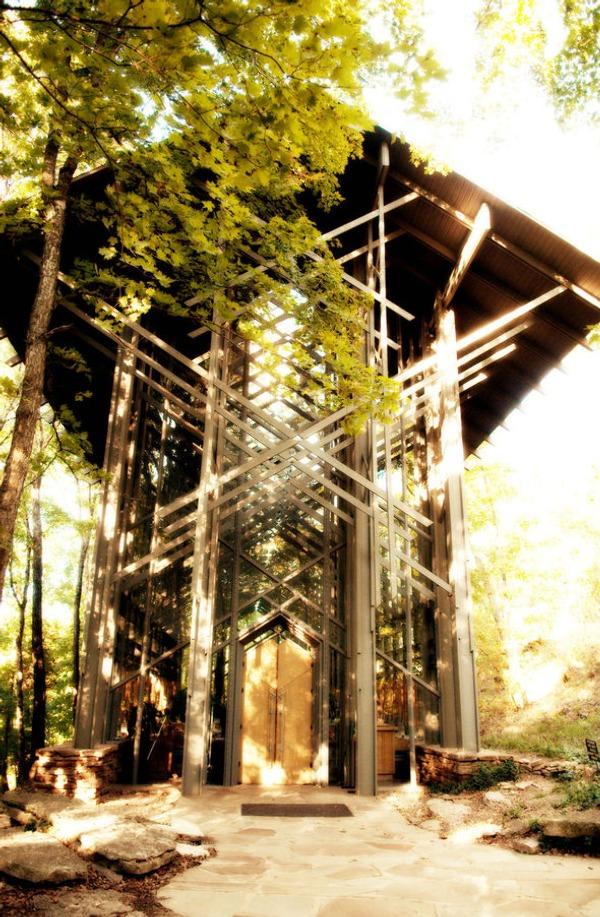
Locate an element on the screen. Image resolution: width=600 pixels, height=917 pixels. windows is located at coordinates (381, 647).